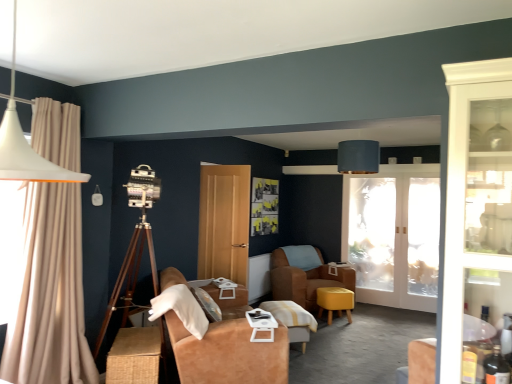
Question: From a real-world perspective, does white plastic tray at center, the 1th table in the front-to-back sequence, stand above wooden tripod at left?

Choices:
 (A) yes
 (B) no

Answer: (B)

Question: Does white plastic tray at center, marked as the 2th table in a left-to-right arrangement, have a lesser width compared to wooden tripod at left?

Choices:
 (A) yes
 (B) no

Answer: (A)

Question: Is the position of white plastic tray at center, the 1th table in the front-to-back sequence, less distant than that of wooden tripod at left?

Choices:
 (A) no
 (B) yes

Answer: (B)

Question: Is white plastic tray at center, the 1th table in the front-to-back sequence, not within wooden tripod at left?

Choices:
 (A) yes
 (B) no

Answer: (A)

Question: Considering the relative sizes of white plastic tray at center, the 2th table when ordered from right to left, and wooden tripod at left in the image provided, is white plastic tray at center, the 2th table when ordered from right to left, wider than wooden tripod at left?

Choices:
 (A) no
 (B) yes

Answer: (A)

Question: Is matte yellow stool at center inside or outside of frosted glass window screen at center?

Choices:
 (A) inside
 (B) outside

Answer: (B)

Question: Is matte yellow stool at center wider or thinner than frosted glass window screen at center?

Choices:
 (A) wide
 (B) thin

Answer: (A)

Question: Visually, is matte yellow stool at center positioned to the left or to the right of frosted glass window screen at center?

Choices:
 (A) left
 (B) right

Answer: (A)

Question: Does point (327, 297) appear closer or farther from the camera than point (353, 268)?

Choices:
 (A) closer
 (B) farther

Answer: (A)

Question: Looking at their shapes, would you say white matte pendant lamp at upper left is wider or thinner than suede-like brown couch at center?

Choices:
 (A) thin
 (B) wide

Answer: (A)

Question: From the image's perspective, is white matte pendant lamp at upper left located above or below suede-like brown couch at center?

Choices:
 (A) below
 (B) above

Answer: (B)

Question: Based on their positions, is white matte pendant lamp at upper left located to the left or right of suede-like brown couch at center?

Choices:
 (A) right
 (B) left

Answer: (B)

Question: Would you say white matte pendant lamp at upper left is inside or outside suede-like brown couch at center?

Choices:
 (A) inside
 (B) outside

Answer: (B)

Question: From the image's perspective, relative to matte yellow stool at center, is wooden tripod at left above or below?

Choices:
 (A) below
 (B) above

Answer: (B)

Question: Is point (122, 322) positioned closer to the camera than point (330, 297)?

Choices:
 (A) closer
 (B) farther

Answer: (A)